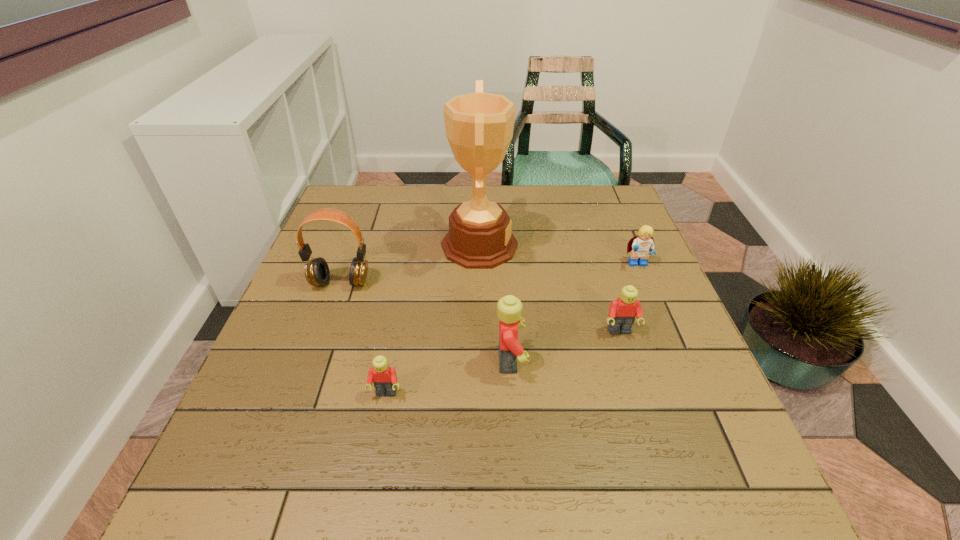
At what (x,y) coordinates should I click in order to perform the action: click on the nearest Lego. Please return your answer as a coordinate pair (x, y). Looking at the image, I should click on (384, 377).

Identify the location of the shortest object. (384, 377).

This screenshot has width=960, height=540. I want to click on the third Lego from right to left, so click(509, 308).

The image size is (960, 540). What are the coordinates of `the tallest Lego` in the screenshot? It's located at (509, 308).

Locate an element on the screen. This screenshot has width=960, height=540. the fifth object from left to right is located at coordinates (622, 312).

Find the location of a particular element. The height and width of the screenshot is (540, 960). the second farthest Lego is located at coordinates (622, 312).

At what (x,y) coordinates should I click in order to perform the action: click on the leftmost object. Please return your answer as a coordinate pair (x, y). The image size is (960, 540). Looking at the image, I should click on coord(317,273).

The width and height of the screenshot is (960, 540). What are the coordinates of `award` in the screenshot? It's located at (479, 126).

The image size is (960, 540). I want to click on the rightmost object, so click(641, 245).

Locate an element on the screen. This screenshot has width=960, height=540. the farthest Lego is located at coordinates (641, 245).